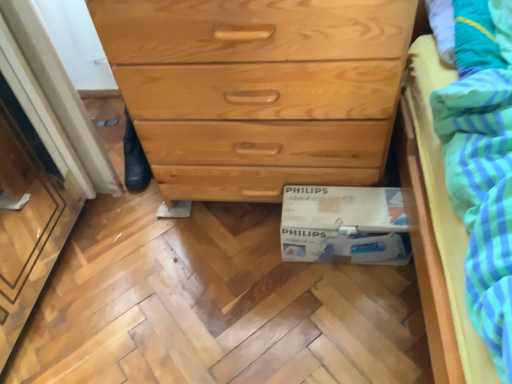
At what (x,y) coordinates should I click in order to perform the action: click on space that is in front of white cardboard box at lower center. Please return your answer as a coordinate pair (x, y). Looking at the image, I should click on (348, 315).